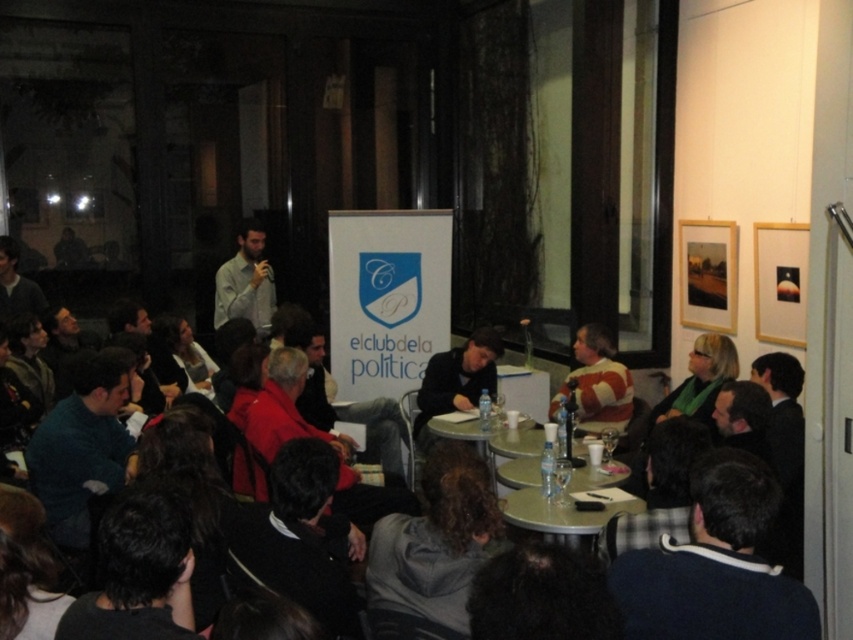
Question: Can you confirm if matte black laptop at center is thinner than green plastic table at center?

Choices:
 (A) yes
 (B) no

Answer: (A)

Question: Estimate the real-world distances between objects in this image. Which object is farther from the matte gray shirt at center?

Choices:
 (A) green plastic table at center
 (B) dark blue sweater at center
 (C) matte black laptop at center

Answer: (C)

Question: Which point appears closest to the camera in this image?

Choices:
 (A) (263, 321)
 (B) (753, 449)
 (C) (445, 397)
 (D) (506, 509)

Answer: (D)

Question: Can you confirm if striped sweater at center is wider than matte gray shirt at center?

Choices:
 (A) yes
 (B) no

Answer: (B)

Question: Which point appears closest to the camera in this image?

Choices:
 (A) (595, 513)
 (B) (248, 225)
 (C) (427, 400)
 (D) (570, 388)

Answer: (A)

Question: Does dark blue sweater at center appear over striped sweater at center?

Choices:
 (A) yes
 (B) no

Answer: (B)